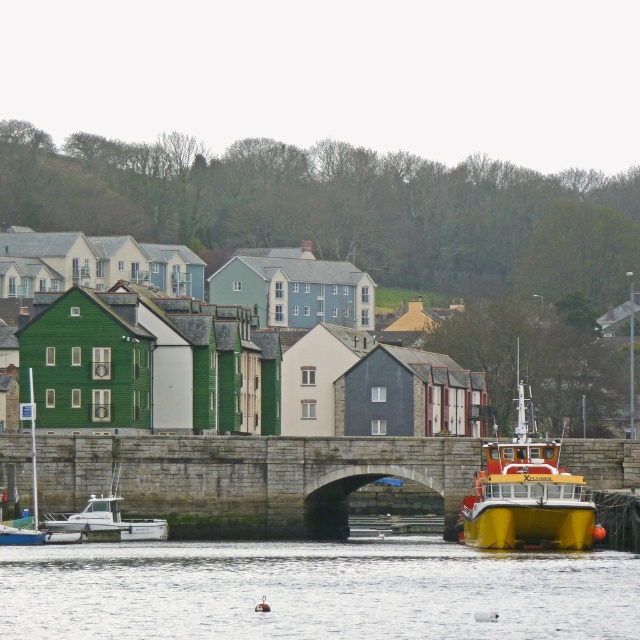
Question: Is transparent water at lower center further to camera compared to stone bridge at center?

Choices:
 (A) yes
 (B) no

Answer: (B)

Question: Among these points, which one is farthest from the camera?

Choices:
 (A) (248, 627)
 (B) (556, 538)
 (C) (93, 509)

Answer: (C)

Question: In this image, where is stone bridge at center located relative to white matte boat at lower left?

Choices:
 (A) right
 (B) left

Answer: (A)

Question: Among these points, which one is farthest from the camera?

Choices:
 (A) (228, 436)
 (B) (109, 502)
 (C) (520, 428)
 (D) (250, 552)

Answer: (A)

Question: Is stone bridge at center smaller than white matte boat at lower left?

Choices:
 (A) yes
 (B) no

Answer: (B)

Question: Which point is farther from the camera taking this photo?

Choices:
 (A) (102, 509)
 (B) (484, 541)
 (C) (413, 436)
 (D) (401, 589)

Answer: (C)